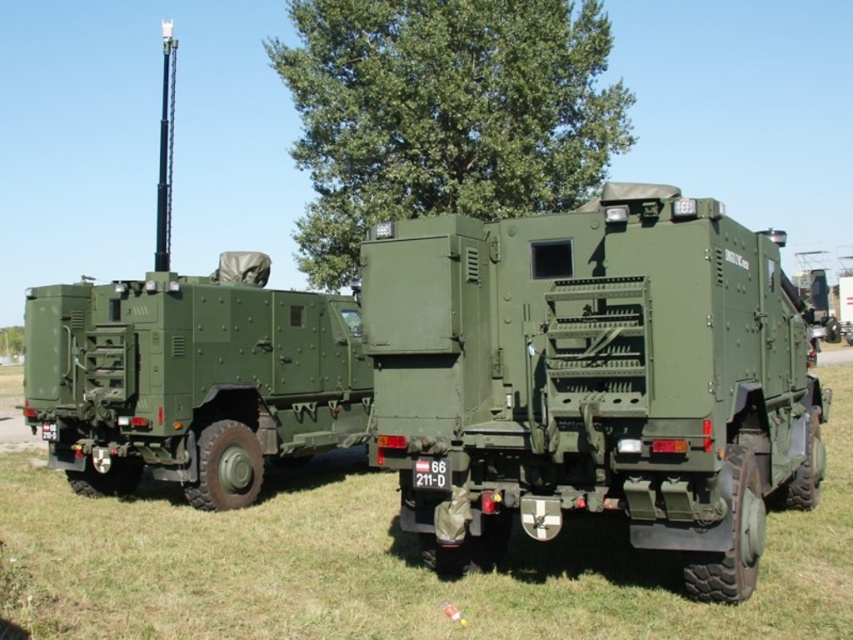
You are a military engineer assessing the parking layout of two vehicles. You need to determine which vehicle is closer to the ground. Which one is shorter between the matte green truck at center and the matte green military vehicle at left?

The matte green truck at center is shorter than the matte green military vehicle at left, so it is closer to the ground.

You are a drone operator trying to land a drone on the grassy area in the image. The drone requires a flat surface at least 1 meter in diameter. Based on the scene, is the green matte grass at lower center suitable for landing?

The green matte grass at lower center is located at point coordinates (386,564). Since the grass is flat and the area is described as a grassy area, it should provide a suitable flat surface for the drone to land safely.

You are a military engineer tasked with moving a 2.5 meter wide equipment container between the matte green truck at center and the matte green military vehicle at left. Based on the scene, can the container fit through the space between them?

The space between the matte green truck at center and the matte green military vehicle at left is 7.55 meters. Since the container is only 2.5 meters wide, it can easily fit through the space between them.